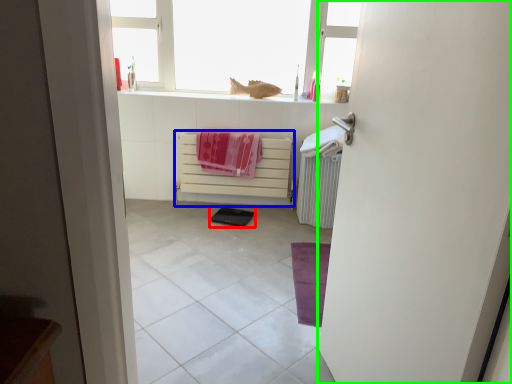
Question: Considering the real-world distances, which object is closest to pad (highlighted by a red box)? cabinetry (highlighted by a blue box) or door (highlighted by a green box).

Choices:
 (A) cabinetry
 (B) door

Answer: (A)